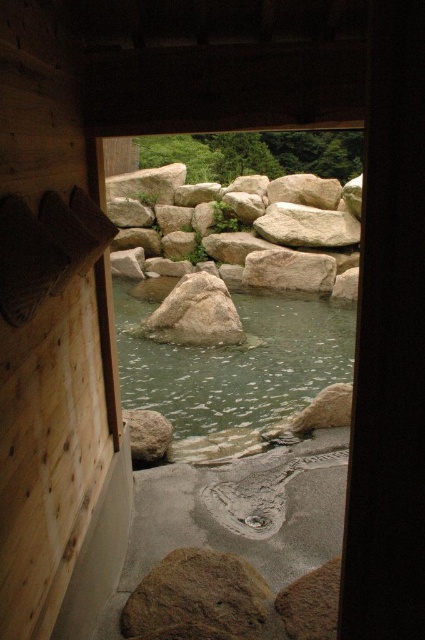
Based on the photo, you are standing at the doorway and want to walk to the point marked as point (127,413). However, there is an obstacle at point (249,625). Will you encounter this obstacle before reaching your destination?

Yes, you will encounter the obstacle at point (249,625) before reaching point (127,413) because point (249,625) is in front of point (127,413).

You are standing in front of the wooden doorway and want to cross to the other side. You see the green stone river at center and the smooth gray rock at center. Which one is smaller in size and can you step on it safely?

The green stone river at center is smaller in size compared to the smooth gray rock at center. However, since it is a river, stepping on it may not be safe as water currents or slippery surfaces could pose risks.

You are standing at the doorway and want to place a 3.5 feet long wooden board between the brown rough rock at lower center and the smooth gray rock at lower left. Will the board fit between them without bending?

The brown rough rock at lower center is 5.77 feet from the smooth gray rock at lower left. Since the board is 3.5 feet long, it will fit between them without bending as the distance is greater than the board length.